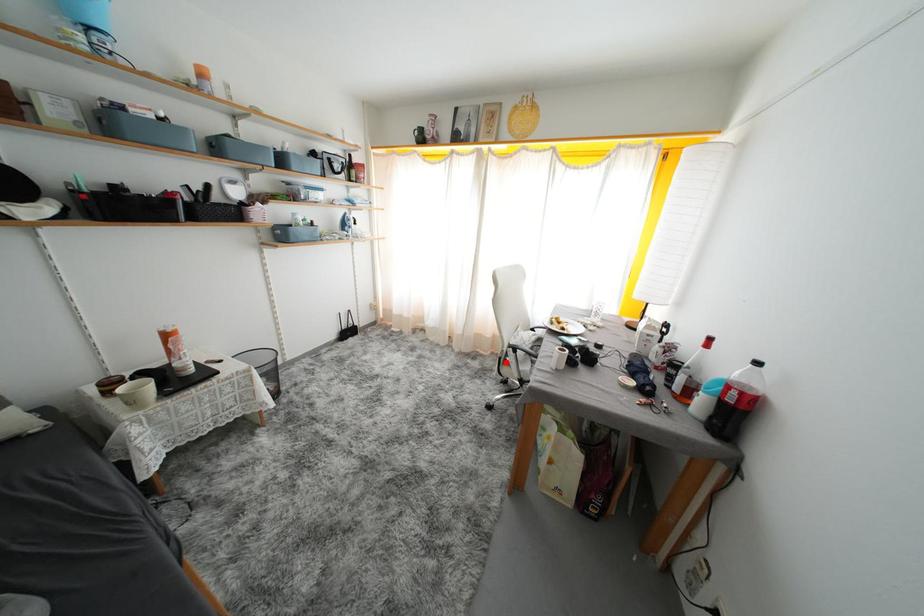
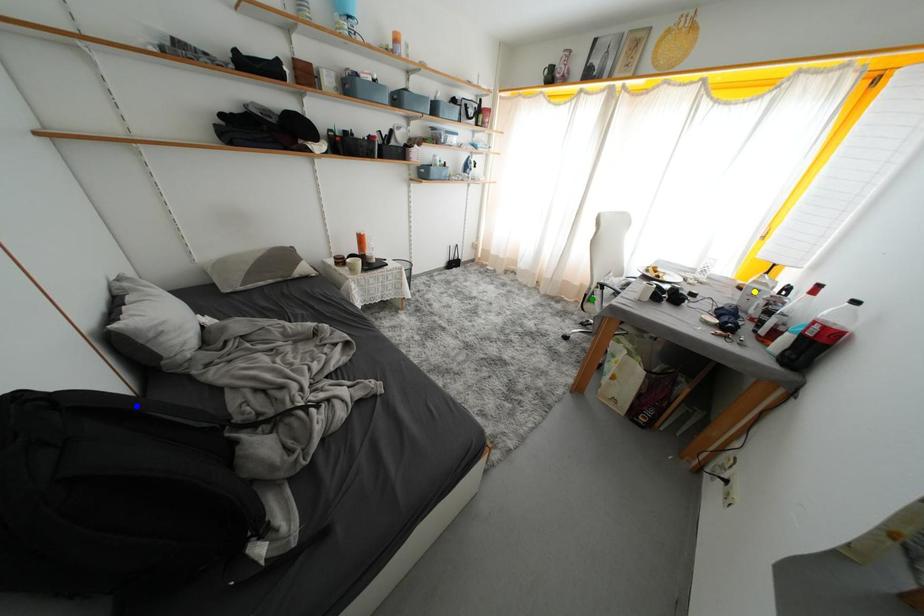
Question: I am providing you with two images of the same scene from different viewpoints. A red point is marked on the first image. You are given multiple points on the second image. Which point in image 2 represents the same 3d spot as the red point in image 1?

Choices:
 (A) green point
 (B) yellow point
 (C) blue point

Answer: (A)